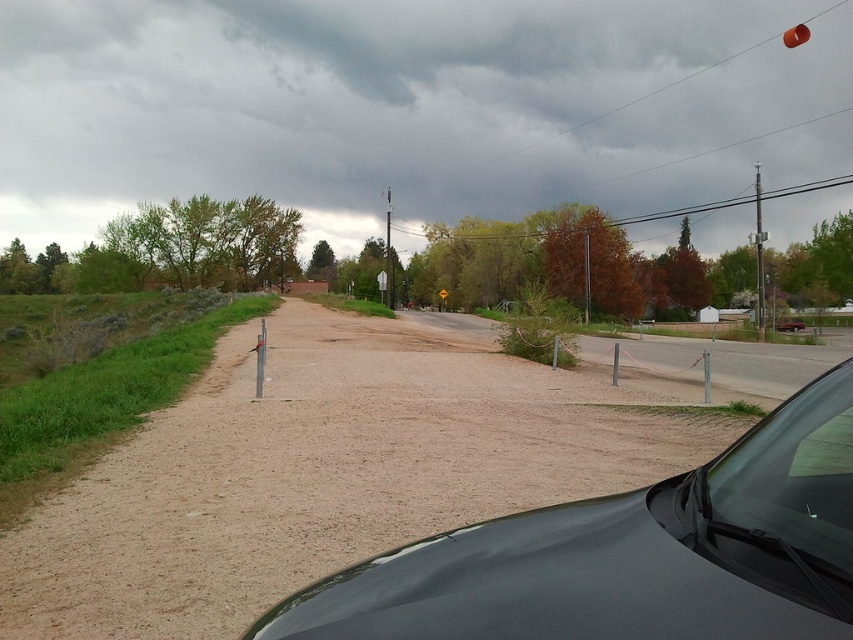
Question: Which point is closer to the camera taking this photo?

Choices:
 (A) (762, 563)
 (B) (793, 449)

Answer: (A)

Question: Which point is farther from the camera taking this photo?

Choices:
 (A) (540, 598)
 (B) (809, 593)

Answer: (A)

Question: Can you confirm if black glossy car at lower right is positioned below transparent glass windshield at lower right?

Choices:
 (A) yes
 (B) no

Answer: (A)

Question: Can you confirm if black glossy car at lower right is smaller than transparent glass windshield at lower right?

Choices:
 (A) yes
 (B) no

Answer: (B)

Question: Does black glossy car at lower right appear on the right side of transparent glass windshield at lower right?

Choices:
 (A) yes
 (B) no

Answer: (B)

Question: Which object appears closest to the camera in this image?

Choices:
 (A) transparent glass windshield at lower right
 (B) black glossy car at lower right

Answer: (B)